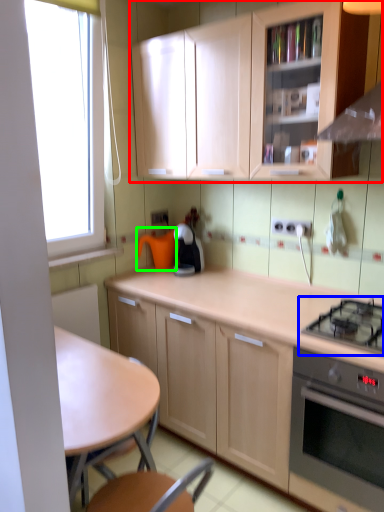
Question: Which object is the closest to the cabinetry (highlighted by a red box)? Choose among these: gas stove (highlighted by a blue box) or appliance (highlighted by a green box).

Choices:
 (A) gas stove
 (B) appliance

Answer: (B)